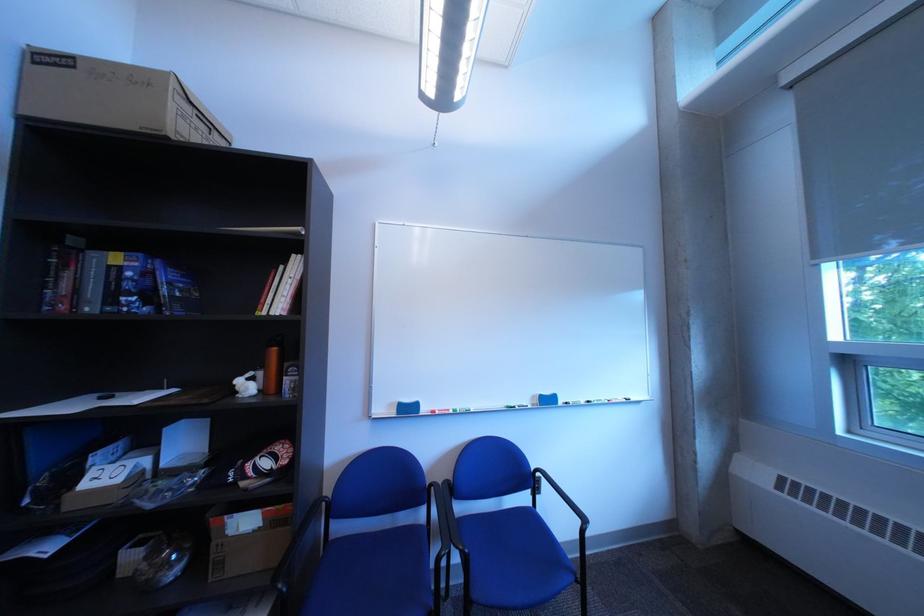
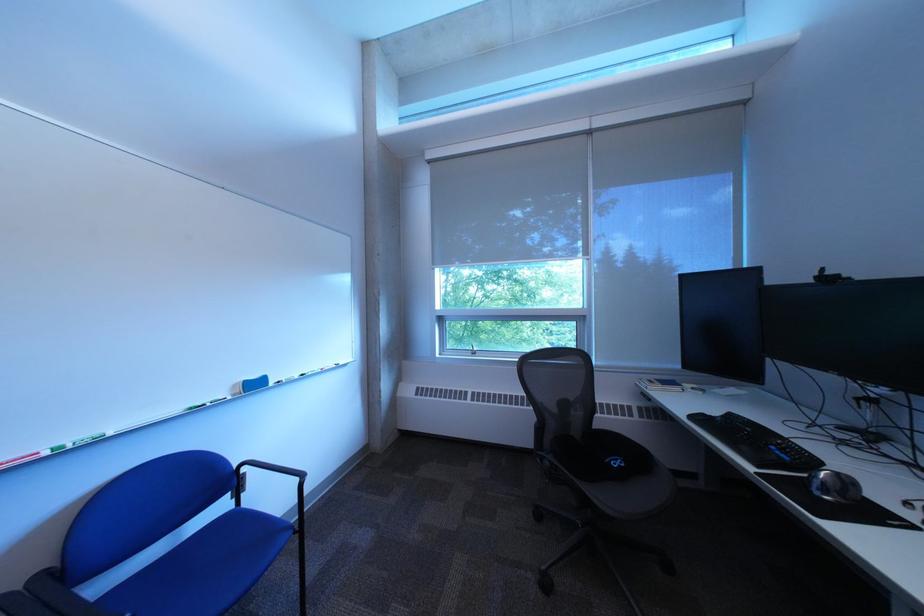
In the second image, find the point that corresponds to [549,399] in the first image.

(249, 387)